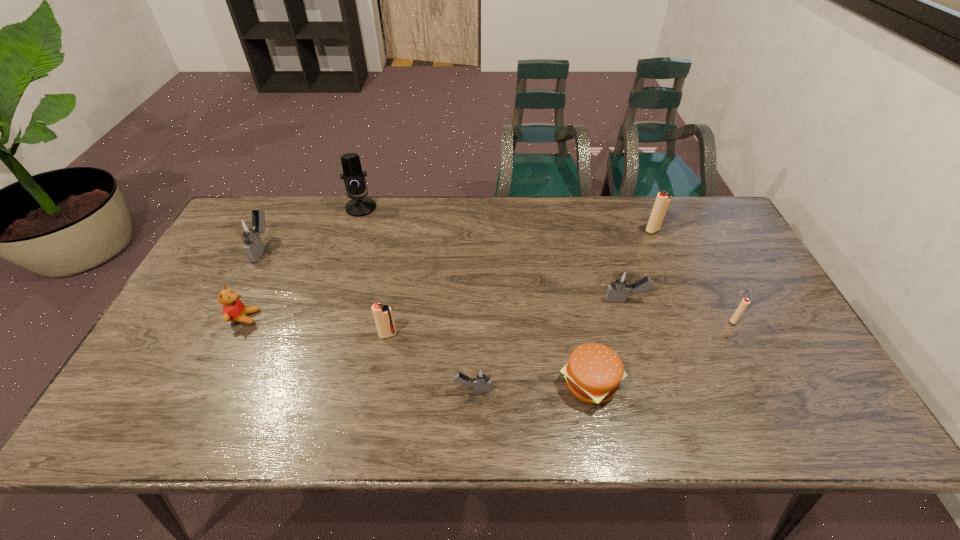
In order to click on the seventh object from right to left in this screenshot , I will do `click(353, 177)`.

Locate an element on the screen. The width and height of the screenshot is (960, 540). black microphone is located at coordinates (353, 177).

Find the location of a particular element. Image resolution: width=960 pixels, height=540 pixels. the second igniter from right to left is located at coordinates (663, 199).

At what (x,y) coordinates should I click in order to perform the action: click on the biggest red igniter. Please return your answer as a coordinate pair (x, y). The image size is (960, 540). Looking at the image, I should click on (663, 199).

Locate an element on the screen. the leftmost gray igniter is located at coordinates (249, 229).

Identify the location of the biggest gray igniter. (249, 229).

Where is `the second smallest gray igniter`? the second smallest gray igniter is located at coordinates (620, 285).

Where is `the fourth nearest igniter`? the fourth nearest igniter is located at coordinates (620, 285).

Image resolution: width=960 pixels, height=540 pixels. Identify the location of the fifth igniter from right to left. click(383, 317).

The width and height of the screenshot is (960, 540). I want to click on the leftmost red igniter, so click(383, 317).